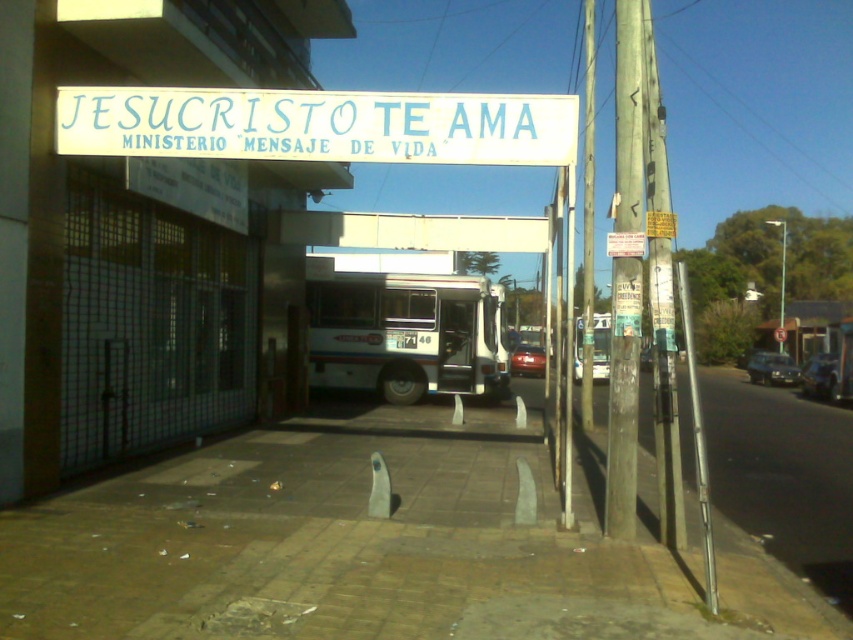
You are a delivery person who needs to park your metallic silver van at center near the brown brick pavement at center. According to the scene, can you park the van so that it is to the right of the pavement?

Yes, because the brown brick pavement at center is already positioned on the left side of the metallic silver van at center, meaning the van is currently to the right of the pavement.

You are a delivery person needing to park a new vehicle in this location. The parking space here is only 2 meters in height. The white matte bus at center and metallic silver sedan at center are currently parked here. Which vehicle would you have to move to make space for your delivery van that is 2.5 meters tall?

The white matte bus at center is much taller than the metallic silver sedan at center. Since your delivery van is 2.5 meters tall and the parking space is only 2 meters in height, you would need to move the white matte bus at center because it is taller and may exceed the height limit, making it impossible to park your van without clearance.